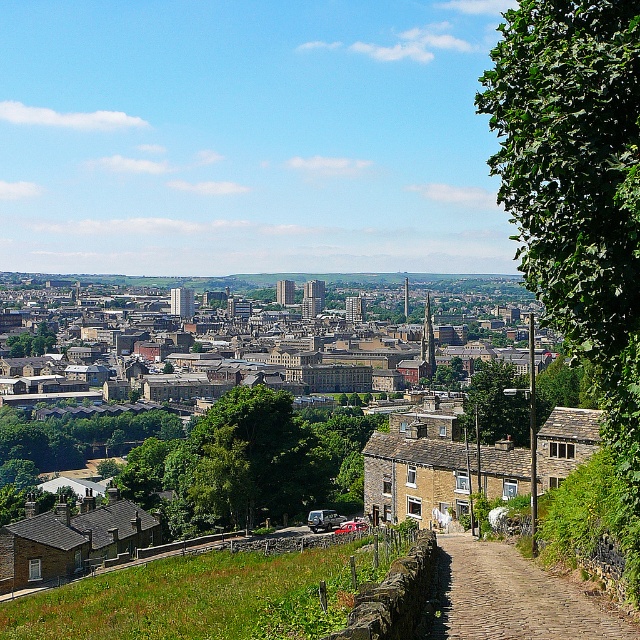
Question: Which point is closer to the camera?

Choices:
 (A) (593, 275)
 (B) (160, 486)

Answer: (A)

Question: Considering the real-world distances, which object is closest to the brown stone buildings at center?

Choices:
 (A) green leafy tree at lower left
 (B) brown cobblestone path at lower right
 (C) green leafy tree at right
 (D) green leafy tree at center

Answer: (A)

Question: Which point is farther from the camera taking this photo?

Choices:
 (A) tap(438, 627)
 (B) tap(554, 76)

Answer: (A)

Question: From the image, what is the correct spatial relationship of green leafy tree at right in relation to green leafy tree at lower left?

Choices:
 (A) left
 (B) right

Answer: (B)

Question: Does green leafy tree at right appear on the right side of green leafy tree at lower left?

Choices:
 (A) no
 (B) yes

Answer: (B)

Question: Is green leafy tree at right above green leafy tree at lower left?

Choices:
 (A) yes
 (B) no

Answer: (A)